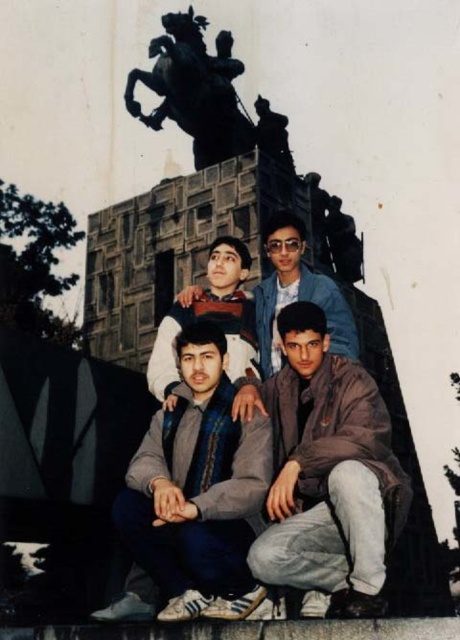
Question: Where is gray fabric jacket at lower center located in relation to black polished stone horse at upper center in the image?

Choices:
 (A) right
 (B) left

Answer: (A)

Question: Which object is farther from the camera taking this photo?

Choices:
 (A) matte blue shirt at center
 (B) gray fabric jacket at lower center

Answer: (A)

Question: Which object appears farthest from the camera in this image?

Choices:
 (A) shiny blue jacket at center
 (B) black polished stone horse at upper center

Answer: (B)

Question: Can you confirm if black polished stone horse at upper center is bigger than shiny blue jacket at center?

Choices:
 (A) yes
 (B) no

Answer: (A)

Question: Among these points, which one is farthest from the camera?

Choices:
 (A) 168,451
 (B) 339,564

Answer: (A)

Question: Can you confirm if gray fabric jacket at lower center is positioned to the right of black polished stone horse at upper center?

Choices:
 (A) yes
 (B) no

Answer: (A)